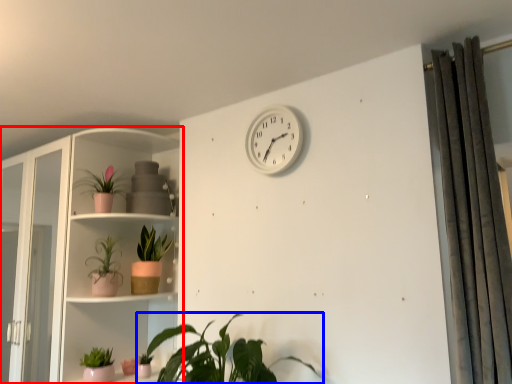
Question: Which of the following is the closest to the observer, shelf (highlighted by a red box) or houseplant (highlighted by a blue box)?

Choices:
 (A) shelf
 (B) houseplant

Answer: (B)